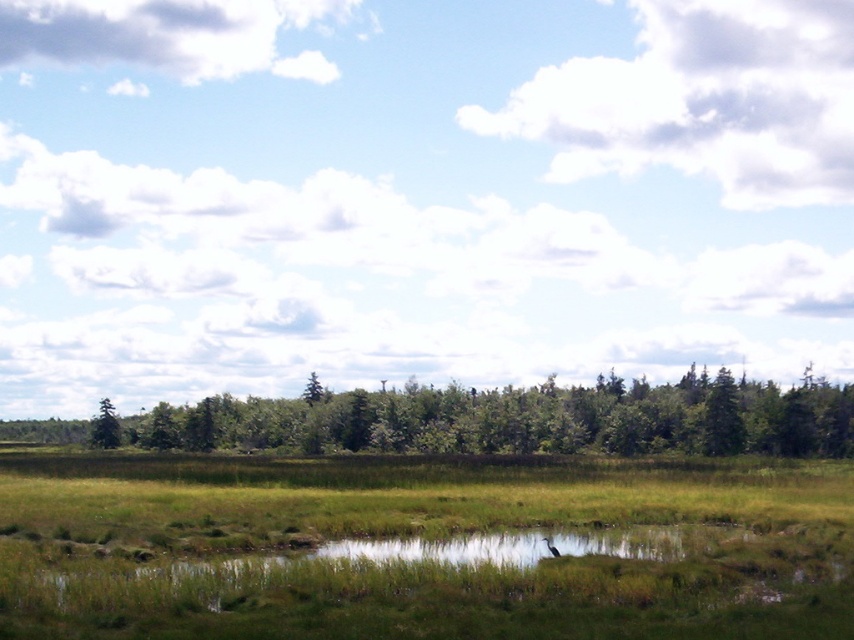
You are standing at the edge of the small body of water in the foreground. You want to reach the green leafy trees at center marked by point (519, 419). What direction should you walk to get there?

To reach the green leafy trees at center marked by point (519, 419) from the water edge, you should walk towards the center of the image since the point is located at center.

You are a hiker who wants to take a photo of the green leafy trees at center from a distance. If your camera has a maximum zoom range of 100 meters, can you capture the trees clearly without moving closer?

The green leafy trees at center are 103.12 meters away from the viewer. Since the camera can only zoom up to 100 meters, you cannot capture them clearly without moving closer.

You are planning to plant a new tree in your backyard. You have two options based on the image you see. The first option is the green leafy trees at center, and the second is the green matte tree at left. Which tree would you choose if you want a larger tree in your backyard?

The green leafy trees at center has a larger size compared to the green matte tree at left, so you should choose the green leafy trees at center for a larger tree in your backyard.